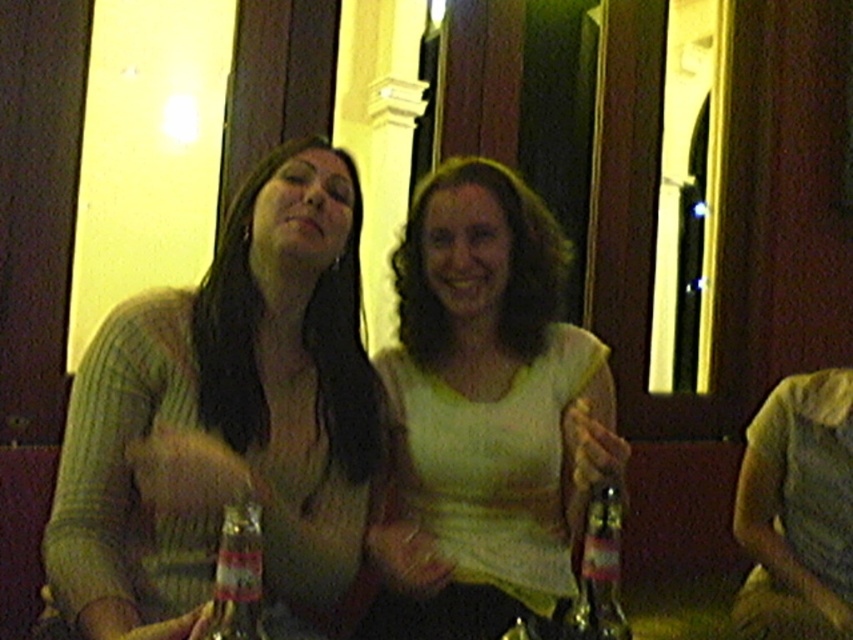
Question: Among these points, which one is nearest to the camera?

Choices:
 (A) (253, 570)
 (B) (166, 324)
 (C) (461, 566)
 (D) (589, 564)

Answer: (A)

Question: Is knitted sweater at left below light green fabric shirt at center?

Choices:
 (A) no
 (B) yes

Answer: (A)

Question: Does light green fabric shirt at center have a greater width compared to translucent glass bottle at center?

Choices:
 (A) yes
 (B) no

Answer: (A)

Question: Which object is positioned farthest from the translucent glass bottle at center?

Choices:
 (A) clear glass bottle at center
 (B) knitted sweater at left
 (C) light green fabric shirt at center

Answer: (B)

Question: Does translucent glass bottle at center appear on the right side of clear glass bottle at center?

Choices:
 (A) no
 (B) yes

Answer: (B)

Question: Estimate the real-world distances between objects in this image. Which object is farther from the knitted sweater at left?

Choices:
 (A) clear glass bottle at center
 (B) light green fabric shirt at center
 (C) translucent glass bottle at center

Answer: (C)